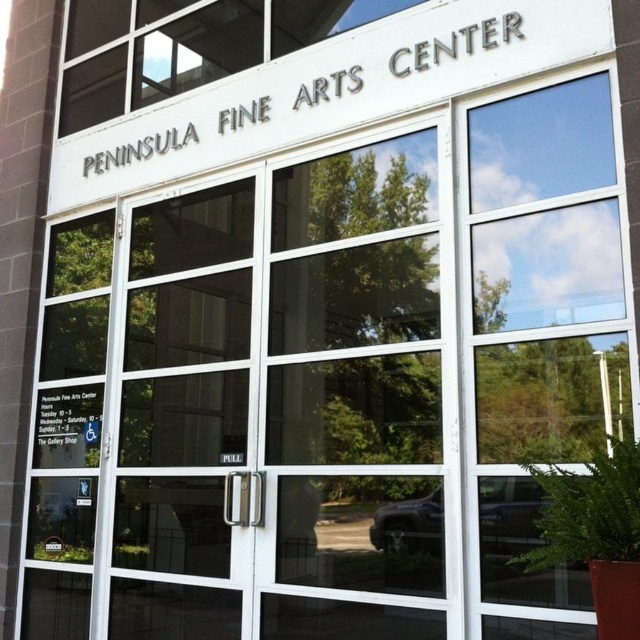
Who is shorter, green leafy plant at lower right or green leafy plant at lower left?

With less height is green leafy plant at lower left.

Where is `green leafy plant at lower right`? green leafy plant at lower right is located at coordinates (589, 516).

Image resolution: width=640 pixels, height=640 pixels. Identify the location of green leafy plant at lower right. (589, 516).